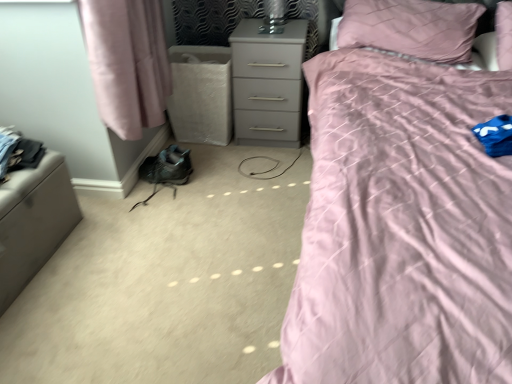
Question: From a real-world perspective, is pink quilted pillow at upper right physically below matte pink quilt at upper right?

Choices:
 (A) no
 (B) yes

Answer: (A)

Question: Does pink quilted pillow at upper right turn towards matte pink quilt at upper right?

Choices:
 (A) no
 (B) yes

Answer: (B)

Question: From a real-world perspective, is pink quilted pillow at upper right on top of matte pink quilt at upper right?

Choices:
 (A) no
 (B) yes

Answer: (B)

Question: Does pink quilted pillow at upper right have a lesser width compared to matte pink quilt at upper right?

Choices:
 (A) yes
 (B) no

Answer: (A)

Question: Is pink quilted pillow at upper right shorter than matte pink quilt at upper right?

Choices:
 (A) yes
 (B) no

Answer: (A)

Question: Looking at the image, does matte gray nightstand at center seem bigger or smaller compared to pink quilted pillow at upper right?

Choices:
 (A) small
 (B) big

Answer: (A)

Question: From the image's perspective, is matte gray nightstand at center located above or below pink quilted pillow at upper right?

Choices:
 (A) below
 (B) above

Answer: (A)

Question: Is point (242, 142) closer or farther from the camera than point (449, 56)?

Choices:
 (A) closer
 (B) farther

Answer: (B)

Question: Considering the positions of matte gray nightstand at center and pink quilted pillow at upper right in the image, is matte gray nightstand at center wider or thinner than pink quilted pillow at upper right?

Choices:
 (A) wide
 (B) thin

Answer: (B)

Question: Is matte gray nightstand at center taller or shorter than dark gray fabric at left?

Choices:
 (A) short
 (B) tall

Answer: (B)

Question: From the image's perspective, is matte gray nightstand at center located above or below dark gray fabric at left?

Choices:
 (A) above
 (B) below

Answer: (A)

Question: Is matte gray nightstand at center inside the boundaries of dark gray fabric at left, or outside?

Choices:
 (A) outside
 (B) inside

Answer: (A)

Question: Looking at their shapes, would you say matte gray nightstand at center is wider or thinner than dark gray fabric at left?

Choices:
 (A) thin
 (B) wide

Answer: (B)

Question: Would you say matte pink quilt at upper right is to the left or to the right of dark gray fabric at left in the picture?

Choices:
 (A) left
 (B) right

Answer: (B)

Question: In terms of width, does matte pink quilt at upper right look wider or thinner when compared to dark gray fabric at left?

Choices:
 (A) thin
 (B) wide

Answer: (B)